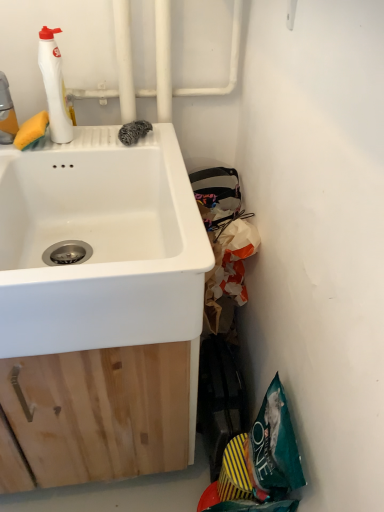
This screenshot has width=384, height=512. What are the coordinates of `vacant area that lies to the right of white matte bottle at upper left, which ranks as the second cleaning product in left-to-right order` in the screenshot? It's located at (110, 138).